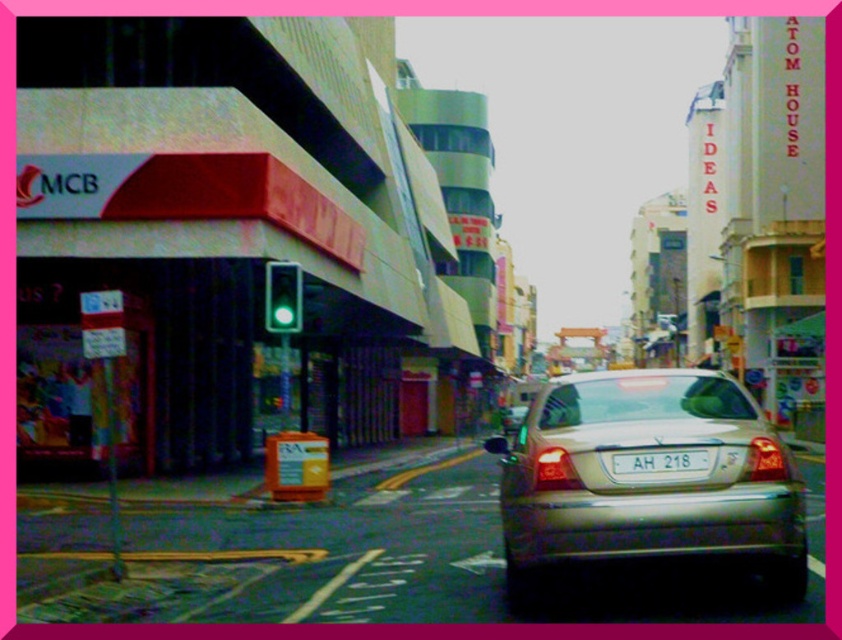
You are a pedestrian standing behind the silver metallic car at center. You want to read the license plate text on the white plastic license plate at center. Can you see the license plate text clearly?

The silver metallic car at center is positioned under white plastic license plate at center, so the car is blocking the license plate, making it difficult to see the text clearly.

You are a pedestrian trying to cross the street and see the silver metallic car at center and the white plastic license plate at center. Which object is bigger?

The silver metallic car at center is bigger than the white plastic license plate at center.

You are a pedestrian standing at the crosswalk and see the silver metallic car at center and the green glass traffic light at center. Which one is closer to you?

The silver metallic car at center is closer to you because it is larger in size than the green glass traffic light at center.